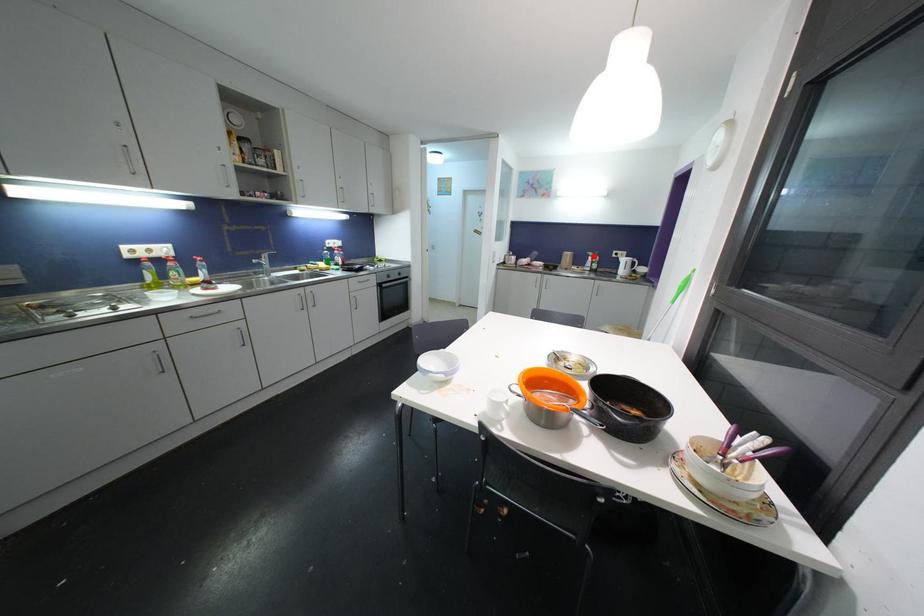
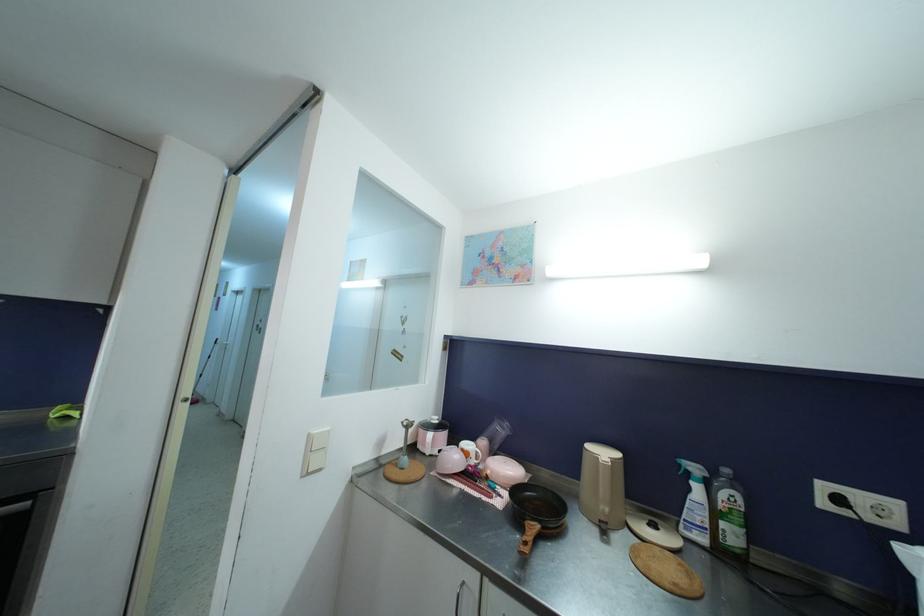
In the second image, find the point that corresponds to the highlighted location in the first image.

(699, 472)